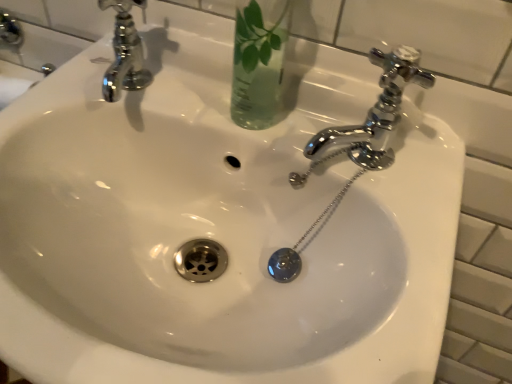
Question: From the image's perspective, is transparent glass vase at upper center beneath chrome/metallic faucet at right?

Choices:
 (A) yes
 (B) no

Answer: (B)

Question: Is transparent glass vase at upper center far away from chrome/metallic faucet at right?

Choices:
 (A) no
 (B) yes

Answer: (A)

Question: Is transparent glass vase at upper center aimed at chrome/metallic faucet at right?

Choices:
 (A) no
 (B) yes

Answer: (A)

Question: Is transparent glass vase at upper center bigger than chrome/metallic faucet at right?

Choices:
 (A) no
 (B) yes

Answer: (B)

Question: Is transparent glass vase at upper center positioned with its back to chrome/metallic faucet at right?

Choices:
 (A) yes
 (B) no

Answer: (B)

Question: Does transparent glass vase at upper center have a lesser height compared to chrome/metallic faucet at right?

Choices:
 (A) no
 (B) yes

Answer: (A)

Question: Is chrome/metallic faucet at right taller than transparent glass vase at upper center?

Choices:
 (A) no
 (B) yes

Answer: (A)

Question: Is chrome/metallic faucet at right behind transparent glass vase at upper center?

Choices:
 (A) yes
 (B) no

Answer: (A)

Question: Is chrome/metallic faucet at right touching transparent glass vase at upper center?

Choices:
 (A) yes
 (B) no

Answer: (B)

Question: Is chrome/metallic faucet at right smaller than transparent glass vase at upper center?

Choices:
 (A) yes
 (B) no

Answer: (A)

Question: Is transparent glass vase at upper center surrounded by chrome/metallic faucet at right?

Choices:
 (A) yes
 (B) no

Answer: (B)

Question: Is chrome/metallic faucet at right closer to the viewer compared to transparent glass vase at upper center?

Choices:
 (A) yes
 (B) no

Answer: (B)

Question: Considering the positions of transparent glass vase at upper center and chrome/metallic faucet at right in the image, is transparent glass vase at upper center bigger or smaller than chrome/metallic faucet at right?

Choices:
 (A) small
 (B) big

Answer: (B)